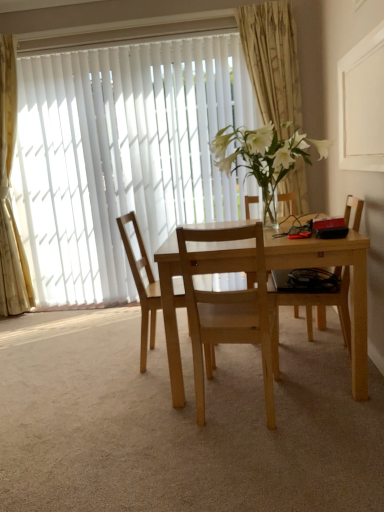
In order to click on free space that is to the left of light wood chair at center, which is the second chair in right-to-left order in this screenshot , I will do `click(145, 415)`.